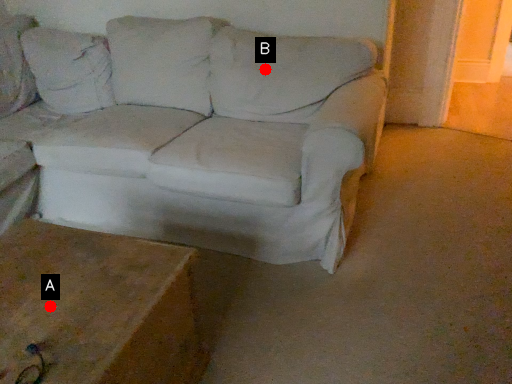
Question: Two points are circled on the image, labeled by A and B beside each circle. Which point is closer to the camera taking this photo?

Choices:
 (A) A is closer
 (B) B is closer

Answer: (A)